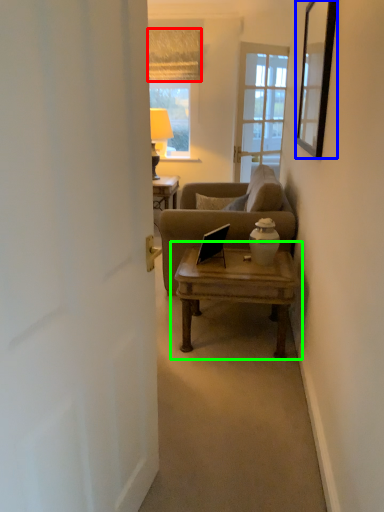
Question: Estimate the real-world distances between objects in this image. Which object is closer to curtain (highlighted by a red box), picture frame (highlighted by a blue box) or coffee table (highlighted by a green box)?

Choices:
 (A) picture frame
 (B) coffee table

Answer: (A)